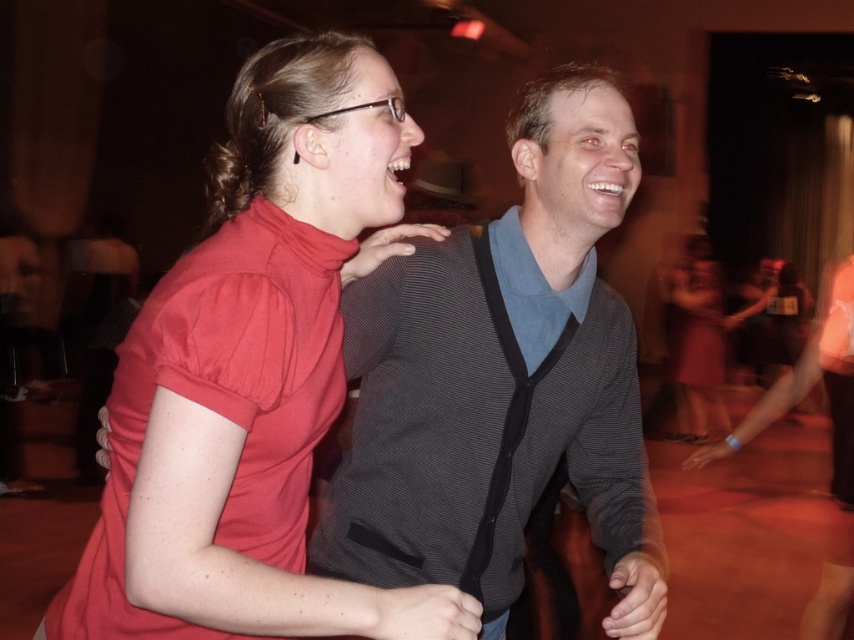
Question: Which point is closer to the camera?

Choices:
 (A) matte red turtleneck at upper left
 (B) matte red dress at lower right
 (C) gray textured sweater at center

Answer: (A)

Question: Can you confirm if gray textured sweater at center is positioned to the right of matte red dress at lower right?

Choices:
 (A) yes
 (B) no

Answer: (B)

Question: Does gray textured sweater at center have a larger size compared to matte red dress at lower right?

Choices:
 (A) yes
 (B) no

Answer: (B)

Question: Is matte red turtleneck at upper left above matte red dress at lower right?

Choices:
 (A) yes
 (B) no

Answer: (A)

Question: Which of these objects is positioned farthest from the matte red dress at lower right?

Choices:
 (A) gray textured sweater at center
 (B) matte red turtleneck at upper left

Answer: (B)

Question: Which point is closer to the camera taking this photo?

Choices:
 (A) (393, 212)
 (B) (547, 380)
 (C) (718, 280)

Answer: (A)